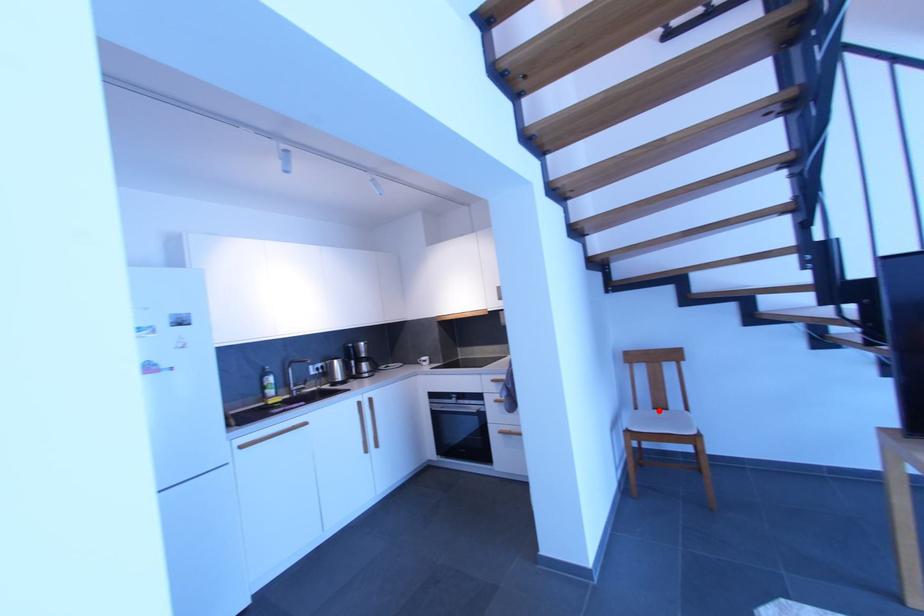
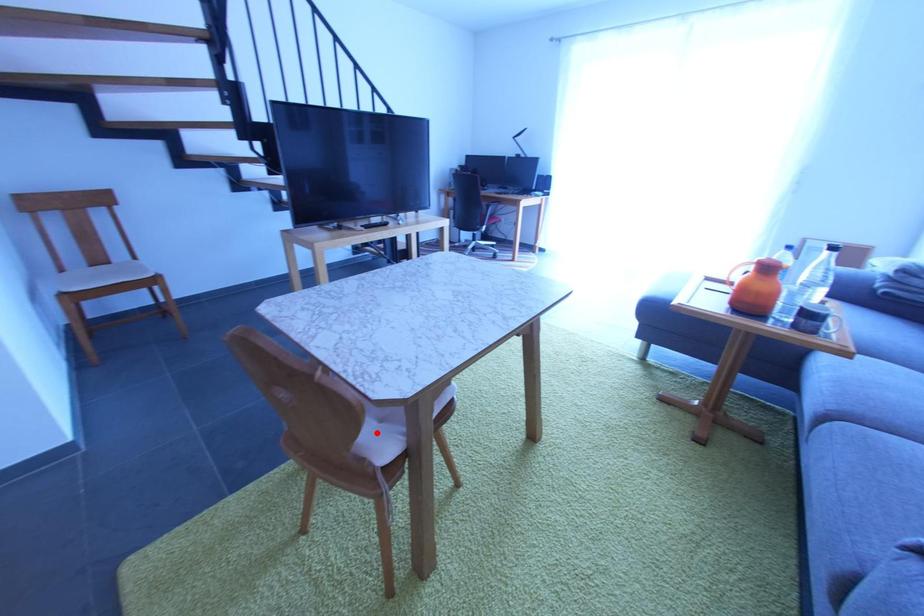
In the scene shown: I am providing you with two images of the same scene from different viewpoints. A red point is marked on the first image and another point is marked on the second image. Is the marked point in image1 the same physical position as the marked point in image2?

No